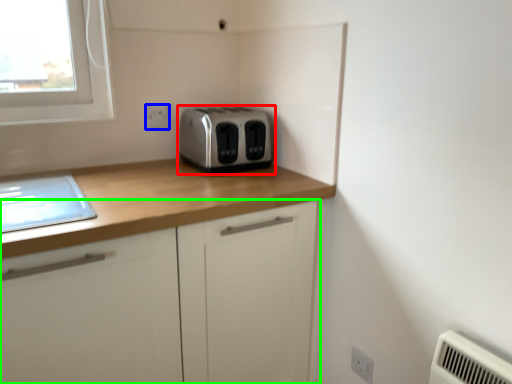
Question: Estimate the real-world distances between objects in this image. Which object is farther from toaster (highlighted by a red box), electric outlet (highlighted by a blue box) or cabinetry (highlighted by a green box)?

Choices:
 (A) electric outlet
 (B) cabinetry

Answer: (B)